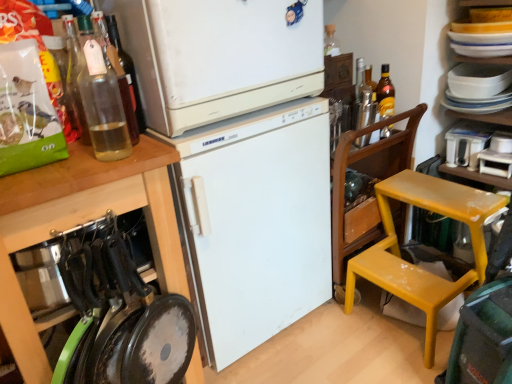
Identify the location of vacant region to the left of clear glass bottle at upper left, marked as the 1th bottle in a front-to-back arrangement. The image size is (512, 384). (56, 171).